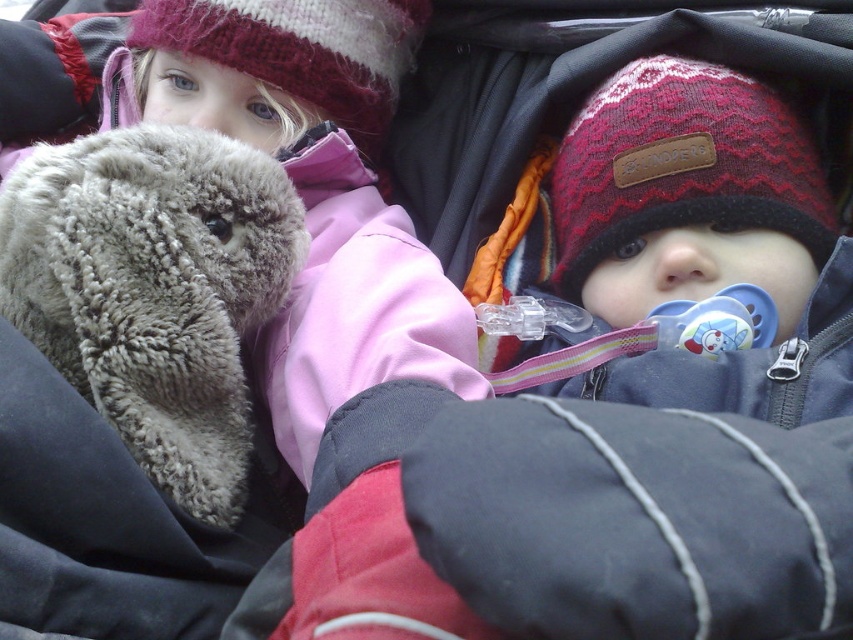
Which is behind, point (61, 276) or point (329, 68)?

Point (329, 68)

Between point (146, 145) and point (419, 26), which one is positioned behind?

The point (419, 26) is more distant.

Where is `fuzzy gray stuffed animal at left`? This screenshot has height=640, width=853. fuzzy gray stuffed animal at left is located at coordinates (154, 289).

Is fuzzy gray stuffed animal at left below knitted woolen hat at upper right?

Yes, fuzzy gray stuffed animal at left is below knitted woolen hat at upper right.

Is point (99, 340) farther from camera compared to point (747, 204)?

No, (99, 340) is in front of (747, 204).

At what (x,y) coordinates should I click in order to perform the action: click on fuzzy gray stuffed animal at left. Please return your answer as a coordinate pair (x, y). Looking at the image, I should click on (154, 289).

Can you confirm if fuzzy gray teddy bear at left is positioned to the right of knitted woolen hat at upper right?

No, fuzzy gray teddy bear at left is not to the right of knitted woolen hat at upper right.

Can you confirm if fuzzy gray teddy bear at left is shorter than knitted woolen hat at upper right?

No.

Is point (395, 275) positioned after point (618, 240)?

No, (395, 275) is in front of (618, 240).

The height and width of the screenshot is (640, 853). What are the coordinates of `fuzzy gray teddy bear at left` in the screenshot? It's located at (311, 186).